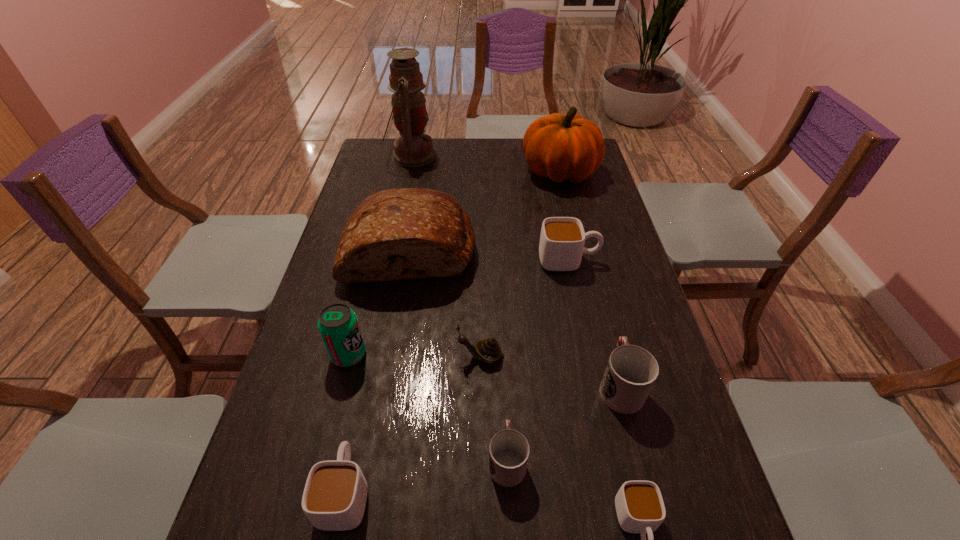
Locate an element on the screen. The width and height of the screenshot is (960, 540). free space between the eighth shortest object and the pumpkin is located at coordinates (485, 210).

Image resolution: width=960 pixels, height=540 pixels. Find the location of `the fourth closest object to the shortest object`. the fourth closest object to the shortest object is located at coordinates (334, 498).

Point out which object is positioned as the fifth nearest to the third tallest object. Please provide its 2D coordinates. Your answer should be formatted as a tuple, i.e. [(x, y)], where the tuple contains the x and y coordinates of a point satisfying the conditions above.

[(413, 148)]

The image size is (960, 540). In order to click on the second closest cup to the second biggest white cup in this screenshot , I will do `click(639, 504)`.

Identify which cup is the second nearest to the left red cup. Please provide its 2D coordinates. Your answer should be formatted as a tuple, i.e. [(x, y)], where the tuple contains the x and y coordinates of a point satisfying the conditions above.

[(631, 371)]

Identify which white cup is the closest to the right red cup. Please provide its 2D coordinates. Your answer should be formatted as a tuple, i.e. [(x, y)], where the tuple contains the x and y coordinates of a point satisfying the conditions above.

[(639, 504)]

Identify which white cup is the third nearest to the smaller red cup. Please provide its 2D coordinates. Your answer should be formatted as a tuple, i.e. [(x, y)], where the tuple contains the x and y coordinates of a point satisfying the conditions above.

[(562, 239)]

The width and height of the screenshot is (960, 540). Identify the location of free point that satisfies the following two spatial constraints: 1. on the side with the handle of the farthest cup; 2. on the handle side of the bigger red cup. (595, 385).

Image resolution: width=960 pixels, height=540 pixels. I want to click on free space that satisfies the following two spatial constraints: 1. on the handle side of the second farthest cup; 2. on the side with the handle of the farthest cup, so click(588, 260).

I want to click on vacant space that satisfies the following two spatial constraints: 1. on the side with the handle of the leftmost cup; 2. on the right side of the pumpkin, so click(411, 172).